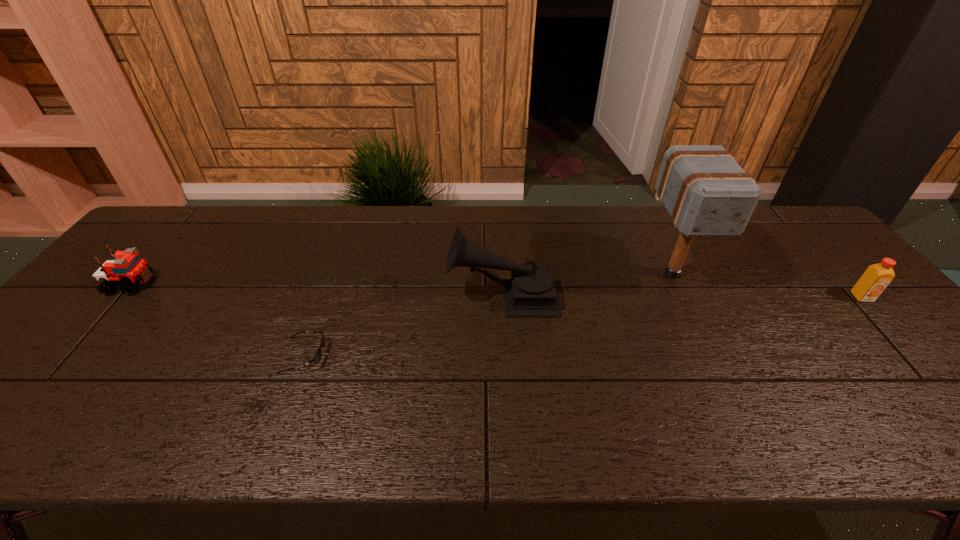
The width and height of the screenshot is (960, 540). Find the location of `free space located from the horn of the phonograph_record`. free space located from the horn of the phonograph_record is located at coordinates (421, 295).

Image resolution: width=960 pixels, height=540 pixels. I want to click on free space located 0.070m from the horn of the phonograph_record, so click(421, 295).

This screenshot has height=540, width=960. In order to click on free space located 0.190m on the front and back of the orange juice in this screenshot , I will do `click(920, 361)`.

Locate an element on the screen. The image size is (960, 540). vacant space located on the front-facing side of the Lego is located at coordinates (297, 284).

Where is `vacant space situated 0.350m on the front-facing side of the shortest object`? vacant space situated 0.350m on the front-facing side of the shortest object is located at coordinates (473, 356).

Image resolution: width=960 pixels, height=540 pixels. In order to click on object at the far edge in this screenshot , I will do `click(706, 192)`.

The width and height of the screenshot is (960, 540). In order to click on object that is at the left edge in this screenshot , I will do `click(126, 268)`.

I want to click on object that is positioned at the right edge, so click(x=875, y=279).

Locate an element on the screen. This screenshot has width=960, height=540. vacant space at the far edge of the desktop is located at coordinates (367, 228).

Locate an element on the screen. Image resolution: width=960 pixels, height=540 pixels. free region at the right edge of the desktop is located at coordinates (796, 271).